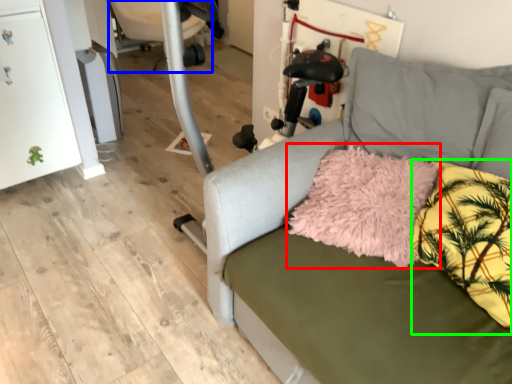
Question: Which is nearer to the throw pillow (highlighted by a red box)? swivel chair (highlighted by a blue box) or pillow (highlighted by a green box).

Choices:
 (A) swivel chair
 (B) pillow

Answer: (B)